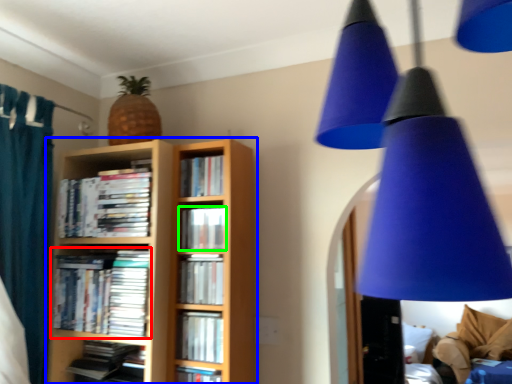
Question: Considering the real-world distances, which object is farthest from book (highlighted by a red box)? bookcase (highlighted by a blue box) or book (highlighted by a green box)?

Choices:
 (A) bookcase
 (B) book

Answer: (B)